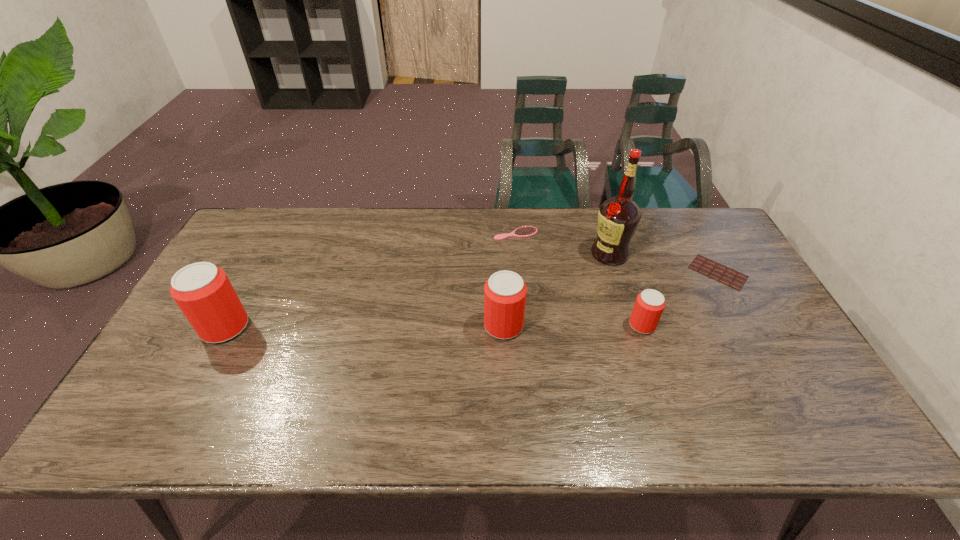
Where is `the leftmost object`? This screenshot has height=540, width=960. the leftmost object is located at coordinates (203, 292).

Image resolution: width=960 pixels, height=540 pixels. Find the location of `the second beer can from right to left`. the second beer can from right to left is located at coordinates (505, 292).

Image resolution: width=960 pixels, height=540 pixels. Identify the location of the second shortest beer can. (505, 292).

This screenshot has height=540, width=960. Identify the location of the rightmost beer can. (649, 305).

Locate an element on the screen. The width and height of the screenshot is (960, 540). the fourth tallest object is located at coordinates 649,305.

Locate an element on the screen. the rightmost object is located at coordinates (730, 277).

This screenshot has height=540, width=960. What are the coordinates of `the shortest object` in the screenshot? It's located at (730, 277).

Locate an element on the screen. Image resolution: width=960 pixels, height=540 pixels. the second shortest object is located at coordinates (526, 231).

The width and height of the screenshot is (960, 540). In order to click on the farthest object in this screenshot , I will do [x=526, y=231].

Where is `alcohol`? alcohol is located at coordinates (618, 218).